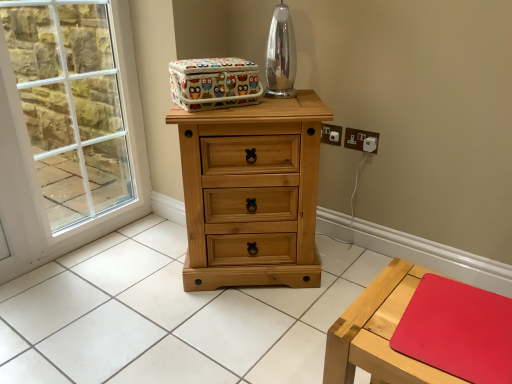
Find the location of a particular element. This screenshot has width=512, height=384. natural wood chest of drawers at center is located at coordinates (251, 193).

Describe the element at coordinates (71, 106) in the screenshot. I see `white glass window at left` at that location.

You are a GUI agent. You are given a task and a screenshot of the screen. Output one action in this format:
    pyautogui.click(x=<x>, y=<y>)
    Task: Click on the white plastic electric outlet at upper right
    The height and width of the screenshot is (384, 512).
    Given the screenshot: What is the action you would take?
    click(x=361, y=140)

From the image's perspective, which one is positioned higher, white plastic electric outlet at upper right or natural wood chest of drawers at center?

white plastic electric outlet at upper right appears higher in the image.

From the picture: From a real-world perspective, relative to natural wood chest of drawers at center, is white plastic electric outlet at upper right vertically above or below?

white plastic electric outlet at upper right is situated higher than natural wood chest of drawers at center in the real world.

Is point (373, 135) positioned before point (260, 216)?

No, (373, 135) is further to viewer.

How different are the orientations of white plastic electric outlet at upper right and natural wood chest of drawers at center in degrees?

The angle between the facing direction of white plastic electric outlet at upper right and the facing direction of natural wood chest of drawers at center is 39.4 degrees.

Is white glass window at left bigger than colorful fabric storage box at upper center?

Yes.

Is white glass window at left at the left side of colorful fabric storage box at upper center?

Yes, white glass window at left is to the left of colorful fabric storage box at upper center.

From a real-world perspective, does white glass window at left stand above colorful fabric storage box at upper center?

Incorrect, from a real-world perspective, white glass window at left is lower than colorful fabric storage box at upper center.

From the image's perspective, is natural wood chest of drawers at center above wooden table at lower right?

Yes.

Could you tell me if natural wood chest of drawers at center is facing wooden table at lower right?

Yes, natural wood chest of drawers at center is turned towards wooden table at lower right.

Does point (250, 150) come farther from viewer compared to point (388, 314)?

That is True.

Considering the positions of objects white glass window at left and wooden table at lower right in the image provided, who is more to the right, white glass window at left or wooden table at lower right?

wooden table at lower right.

From the image's perspective, which one is positioned lower, white glass window at left or wooden table at lower right?

wooden table at lower right, from the image's perspective.

Which of these two, white glass window at left or wooden table at lower right, is bigger?

Bigger between the two is white glass window at left.

Considering the sizes of white glass window at left and wooden table at lower right in the image, is white glass window at left wider or thinner than wooden table at lower right?

Clearly, white glass window at left has less width compared to wooden table at lower right.

Find the location of a particular element. This screenshot has height=384, width=512. table below the natural wood chest of drawers at center (from a real-world perspective) is located at coordinates 379,333.

From the image's perspective, is wooden table at lower right on natural wood chest of drawers at center?

No, from the image's perspective, wooden table at lower right is not over natural wood chest of drawers at center.

From a real-world perspective, is wooden table at lower right above or below natural wood chest of drawers at center?

From a real-world perspective, wooden table at lower right is physically below natural wood chest of drawers at center.

Is wooden table at lower right placed right next to natural wood chest of drawers at center?

No, wooden table at lower right is not with natural wood chest of drawers at center.

Is point (256, 72) behind point (192, 143)?

Yes, point (256, 72) is farther from viewer.

Which of these two, colorful fabric storage box at upper center or natural wood chest of drawers at center, stands taller?

Standing taller between the two is natural wood chest of drawers at center.

Can you see colorful fabric storage box at upper center touching natural wood chest of drawers at center?

colorful fabric storage box at upper center and natural wood chest of drawers at center are not in contact.

Is natural wood chest of drawers at center inside colorful fabric storage box at upper center?

That's incorrect, natural wood chest of drawers at center is not inside colorful fabric storage box at upper center.

Is white glass window at left looking in the opposite direction of natural wood chest of drawers at center?

white glass window at left is not turned away from natural wood chest of drawers at center.

From a real-world perspective, is white glass window at left above or below natural wood chest of drawers at center?

Clearly, from a real-world perspective, white glass window at left is above natural wood chest of drawers at center.

From the image's perspective, which one is positioned lower, white glass window at left or natural wood chest of drawers at center?

natural wood chest of drawers at center, from the image's perspective.

I want to click on the chest of drawers lying below the white plastic electric outlet at upper right (from the image's perspective), so click(251, 193).

Identify the location of storage box that appears above the white glass window at left (from the image's perspective). (214, 83).

Considering their positions, is natural wood chest of drawers at center positioned closer to white glass window at left than colorful fabric storage box at upper center?

Based on the image, natural wood chest of drawers at center appears to be nearer to white glass window at left.

Which object lies further to the anchor point colorful fabric storage box at upper center, white plastic electric outlet at upper right or white glass window at left?

The object further to colorful fabric storage box at upper center is white glass window at left.

Consider the image. From the image, which object appears to be farther from colorful fabric storage box at upper center, white plastic electric outlet at upper right or wooden table at lower right?

Among the two, wooden table at lower right is located further to colorful fabric storage box at upper center.

From the image, which object appears to be farther from colorful fabric storage box at upper center, natural wood chest of drawers at center or wooden table at lower right?

wooden table at lower right lies further to colorful fabric storage box at upper center than the other object.

Estimate the real-world distances between objects in this image. Which object is closer to colorful fabric storage box at upper center, wooden table at lower right or white plastic electric outlet at upper right?

white plastic electric outlet at upper right is positioned closer to the anchor colorful fabric storage box at upper center.

Estimate the real-world distances between objects in this image. Which object is further from wooden table at lower right, white glass window at left or natural wood chest of drawers at center?

white glass window at left is further to wooden table at lower right.

Consider the image. Considering their positions, is white glass window at left positioned further to colorful fabric storage box at upper center than white plastic electric outlet at upper right?

white glass window at left lies further to colorful fabric storage box at upper center than the other object.

Estimate the real-world distances between objects in this image. Which object is further from white plastic electric outlet at upper right, colorful fabric storage box at upper center or white glass window at left?

white glass window at left is positioned further to the anchor white plastic electric outlet at upper right.

You are a GUI agent. You are given a task and a screenshot of the screen. Output one action in this format:
    pyautogui.click(x=<x>, y=<y>)
    Task: Click on the chest of drawers between colorful fabric storage box at upper center and white plastic electric outlet at upper right
    Image resolution: width=512 pixels, height=384 pixels.
    Given the screenshot: What is the action you would take?
    [251, 193]

Locate an element on the screen. The image size is (512, 384). storage box located between white glass window at left and wooden table at lower right in the left-right direction is located at coordinates (214, 83).

Image resolution: width=512 pixels, height=384 pixels. In order to click on storage box between wooden table at lower right and white plastic electric outlet at upper right in the front-back direction in this screenshot , I will do `click(214, 83)`.

Identify the location of the chest of drawers situated between white glass window at left and wooden table at lower right from left to right. (251, 193).